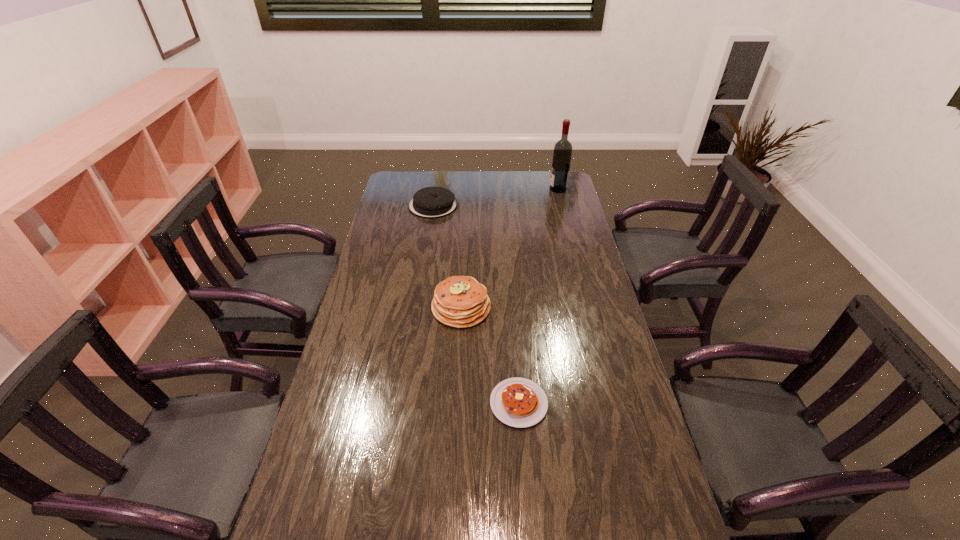
At what (x,y) coordinates should I click in order to perform the action: click on free space located on the front and back of the alcohol. Please return your answer as a coordinate pair (x, y). This screenshot has width=960, height=540. Looking at the image, I should click on (506, 189).

This screenshot has width=960, height=540. What are the coordinates of `free spot located on the left of the second tallest object` in the screenshot? It's located at point(379,308).

The width and height of the screenshot is (960, 540). In order to click on free space located on the right of the second shortest pancake in this screenshot , I will do `click(503, 206)`.

Find the location of a particular element. free space located 0.100m on the right of the nearest pancake is located at coordinates (584, 403).

Find the location of a particular element. The width and height of the screenshot is (960, 540). alcohol that is at the far edge is located at coordinates (562, 153).

This screenshot has height=540, width=960. I want to click on pancake that is positioned at the far edge, so click(430, 202).

Locate an element on the screen. object present at the left edge is located at coordinates (430, 202).

The height and width of the screenshot is (540, 960). In order to click on object located in the right edge section of the desktop in this screenshot , I will do `click(562, 153)`.

Image resolution: width=960 pixels, height=540 pixels. In order to click on object located in the far left corner section of the desktop in this screenshot , I will do `click(430, 202)`.

The height and width of the screenshot is (540, 960). What are the coordinates of `object that is at the far right corner` in the screenshot? It's located at (562, 153).